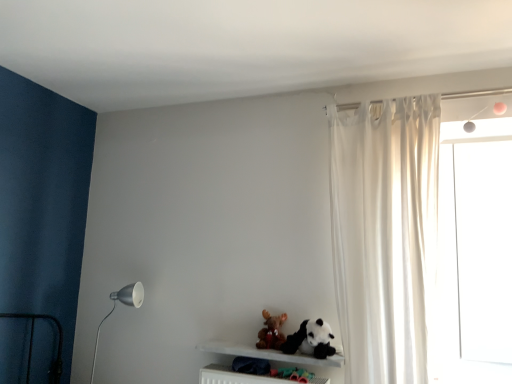
Question: Do you think brown plush toy at center, placed as the 2th toy when sorted from right to left, is within matte white metal floor lamp at left, or outside of it?

Choices:
 (A) outside
 (B) inside

Answer: (A)

Question: Is brown plush toy at center, placed as the 2th toy when sorted from right to left, taller or shorter than matte white metal floor lamp at left?

Choices:
 (A) tall
 (B) short

Answer: (B)

Question: Estimate the real-world distances between objects in this image. Which object is farther from the white sheer curtain at right?

Choices:
 (A) matte white metal floor lamp at left
 (B) transparent glass window at right
 (C) white matte shelf at lower center
 (D) black plush panda at lower center, positioned as the 2th toy in left-to-right order
 (E) brown plush toy at center, positioned as the first toy in left-to-right order

Answer: (A)

Question: Considering the real-world distances, which object is farthest from the white sheer curtain at right?

Choices:
 (A) white matte shelf at lower center
 (B) brown plush toy at center, positioned as the first toy in left-to-right order
 (C) matte white metal floor lamp at left
 (D) transparent glass window at right
 (E) black plush panda at lower center, positioned as the 2th toy in left-to-right order

Answer: (C)